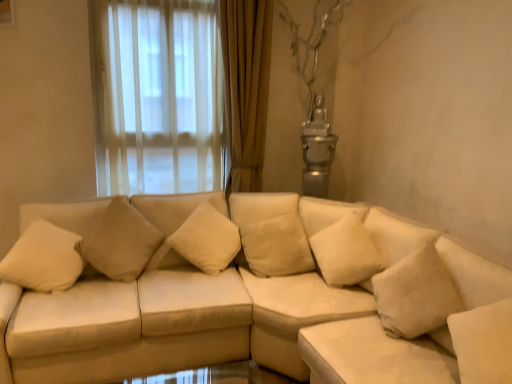
Question: Which direction should I rotate to look at beige fabric pillow at center, arranged as the 1th pillow when viewed from the left?

Choices:
 (A) left
 (B) right

Answer: (A)

Question: Is beige leather couch at center not close to beige fabric pillow at center, which is the 2th pillow from left to right?

Choices:
 (A) yes
 (B) no

Answer: (B)

Question: Does beige leather couch at center have a greater width compared to beige fabric pillow at center, positioned as the first pillow in right-to-left order?

Choices:
 (A) no
 (B) yes

Answer: (B)

Question: Is beige leather couch at center positioned with its back to beige fabric pillow at center, which is the 2th pillow from left to right?

Choices:
 (A) no
 (B) yes

Answer: (A)

Question: Can you confirm if beige leather couch at center is bigger than beige fabric pillow at center, which is the 2th pillow from left to right?

Choices:
 (A) no
 (B) yes

Answer: (B)

Question: Is beige leather couch at center to the left of beige fabric pillow at center, which is the 2th pillow from left to right, from the viewer's perspective?

Choices:
 (A) no
 (B) yes

Answer: (B)

Question: Is beige leather couch at center oriented towards beige fabric pillow at center, positioned as the first pillow in right-to-left order?

Choices:
 (A) no
 (B) yes

Answer: (A)

Question: Does beige fabric pillow at center, which is the 2th pillow from left to right, have a greater width compared to beige leather couch at center?

Choices:
 (A) yes
 (B) no

Answer: (B)

Question: Can you confirm if beige fabric pillow at center, which is the 2th pillow from left to right, is bigger than beige leather couch at center?

Choices:
 (A) yes
 (B) no

Answer: (B)

Question: From a real-world perspective, does beige fabric pillow at center, positioned as the first pillow in right-to-left order, stand above beige leather couch at center?

Choices:
 (A) yes
 (B) no

Answer: (A)

Question: Considering the relative sizes of beige fabric pillow at center, positioned as the first pillow in right-to-left order, and beige leather couch at center in the image provided, is beige fabric pillow at center, positioned as the first pillow in right-to-left order, smaller than beige leather couch at center?

Choices:
 (A) yes
 (B) no

Answer: (A)

Question: Does beige fabric pillow at center, positioned as the first pillow in right-to-left order, have a lesser width compared to beige leather couch at center?

Choices:
 (A) yes
 (B) no

Answer: (A)

Question: Is beige leather couch at center at the back of beige fabric pillow at center, positioned as the first pillow in right-to-left order?

Choices:
 (A) no
 (B) yes

Answer: (A)

Question: From the image's perspective, does beige leather couch at center appear higher than beige fabric pillow at center, which is the second pillow from right to left?

Choices:
 (A) no
 (B) yes

Answer: (A)